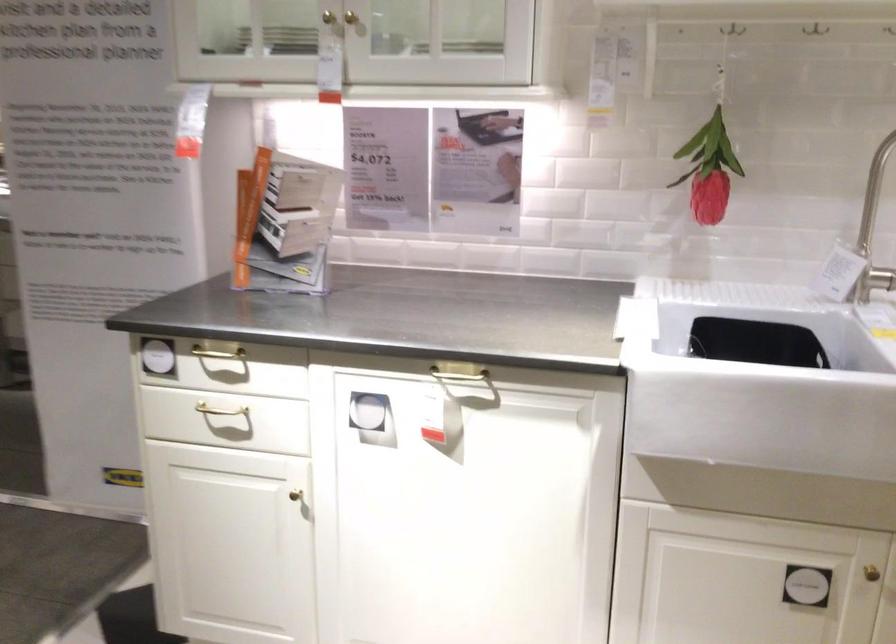
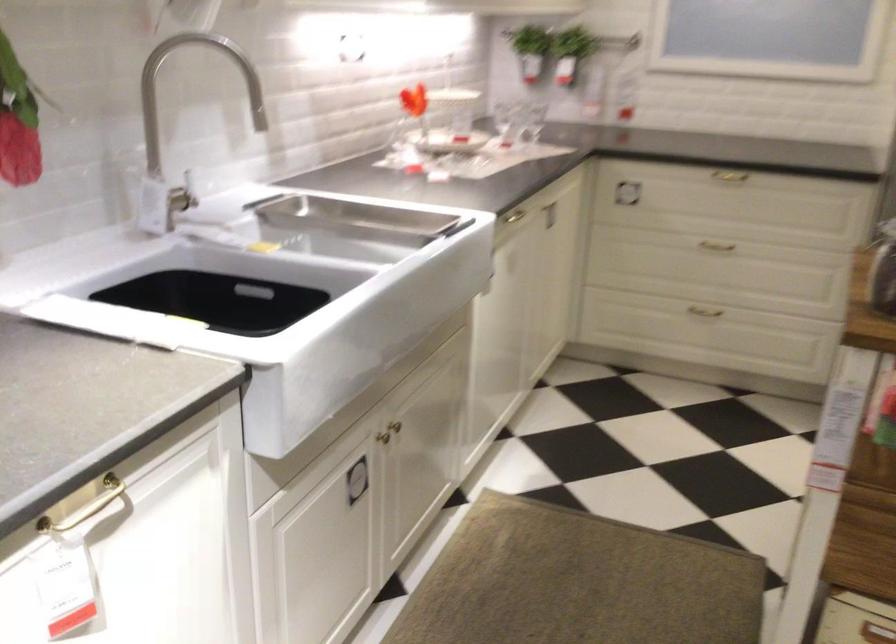
Find the pixel in the second image that matches point (755, 343) in the first image.

(148, 305)